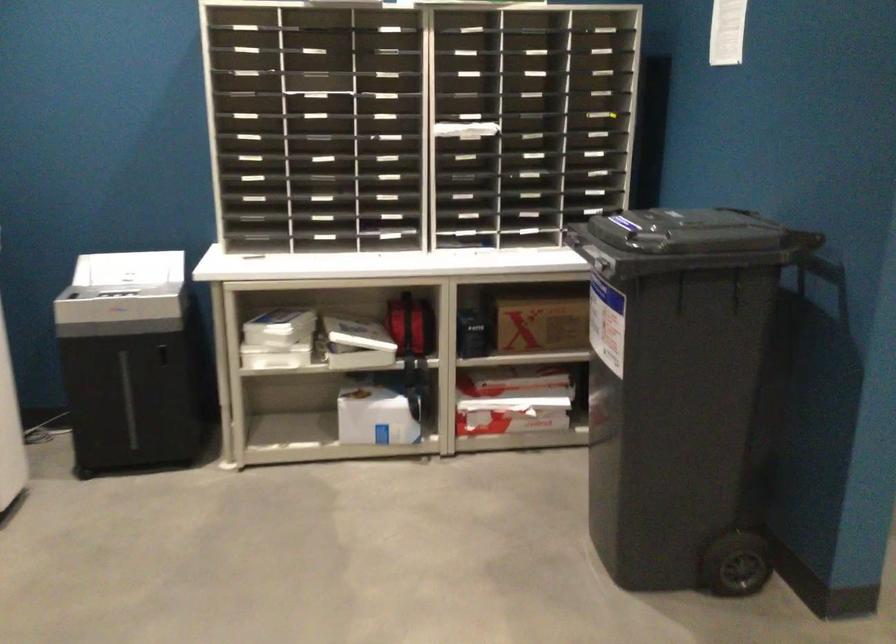
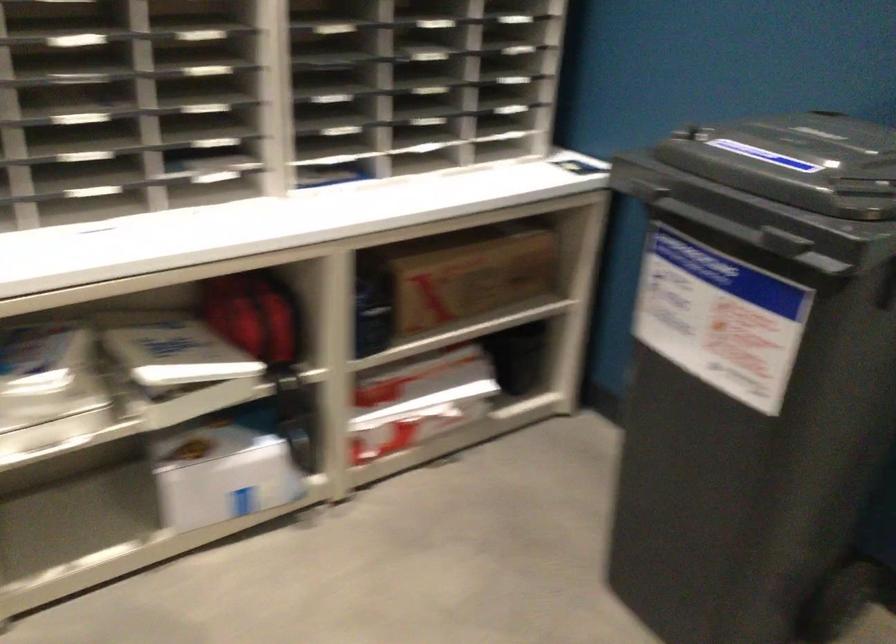
In a continuous first-person perspective shot, in which direction is the camera moving?

The cameraman walked toward left, forward.